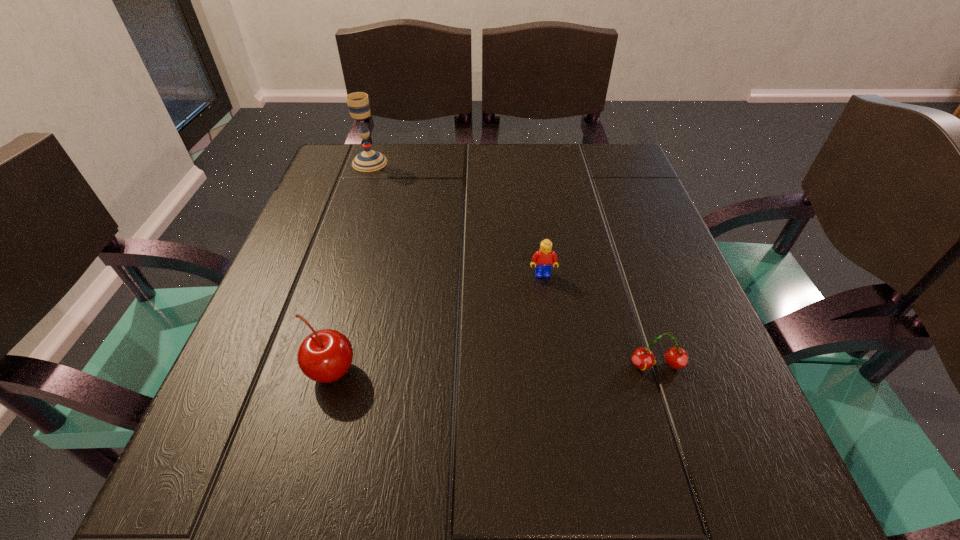
At what (x,y) coordinates should I click in order to perform the action: click on the tallest object. Please return your answer as a coordinate pair (x, y). The height and width of the screenshot is (540, 960). Looking at the image, I should click on point(368,160).

I want to click on the farthest object, so click(x=368, y=160).

At what (x,y) coordinates should I click in order to perform the action: click on the third shortest object. Please return your answer as a coordinate pair (x, y). Looking at the image, I should click on (324, 356).

Image resolution: width=960 pixels, height=540 pixels. Identify the location of the taller cherry. (324, 356).

Locate an element on the screen. the second object from right to left is located at coordinates (543, 257).

Where is `the second farthest object`? The image size is (960, 540). the second farthest object is located at coordinates (543, 257).

Find the location of a particular element. The image size is (960, 540). the shorter cherry is located at coordinates 643,358.

The image size is (960, 540). Identify the location of the right cherry. (643, 358).

Where is `vacant space situated 0.070m on the right of the chalice`? This screenshot has height=540, width=960. vacant space situated 0.070m on the right of the chalice is located at coordinates (416, 163).

The height and width of the screenshot is (540, 960). In order to click on vacant space situated 0.140m on the back of the third shortest object in this screenshot , I will do `click(355, 287)`.